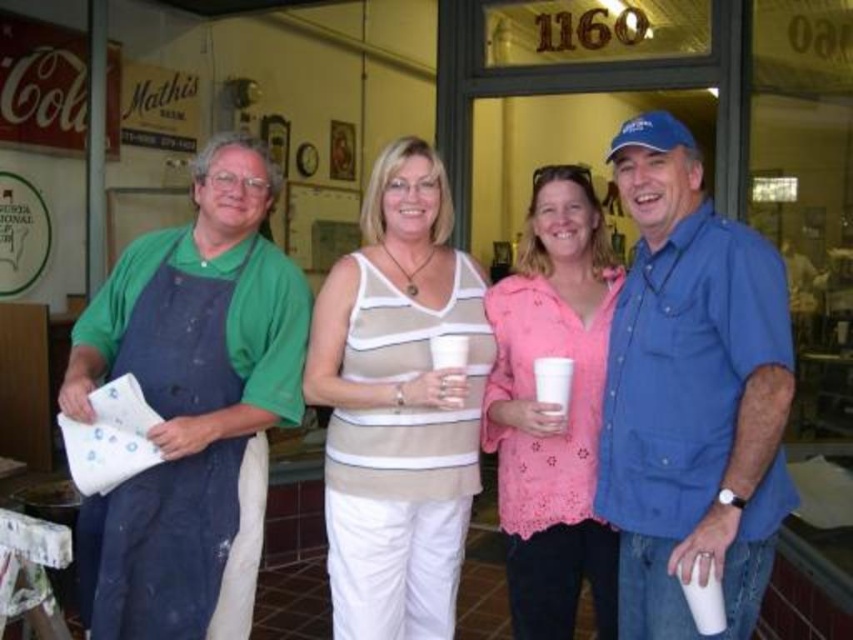
Question: Among these points, which one is nearest to the camera?

Choices:
 (A) (537, 419)
 (B) (374, 438)
 (C) (630, 600)

Answer: (C)

Question: Is green fabric apron at left below blue cotton shirt at right?

Choices:
 (A) no
 (B) yes

Answer: (B)

Question: Is pink lace blouse at center in front of blue denim apron at center?

Choices:
 (A) no
 (B) yes

Answer: (B)

Question: Which object appears farthest from the camera in this image?

Choices:
 (A) green fabric apron at left
 (B) pink lace blouse at center
 (C) blue denim apron at center

Answer: (C)

Question: Does blue cotton shirt at right appear on the right side of beige striped tank top at center?

Choices:
 (A) no
 (B) yes

Answer: (B)

Question: Among these points, which one is nearest to the camera?

Choices:
 (A) (631, 200)
 (B) (242, 589)
 (C) (326, 344)
 (D) (445, 448)

Answer: (A)